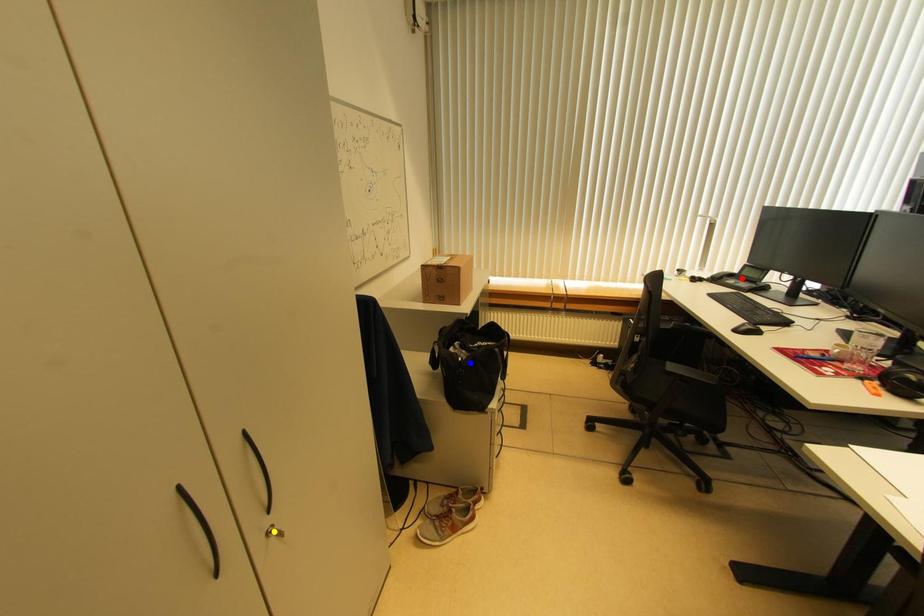
Order these from nearest to farthest:
blue point
red point
yellow point

1. yellow point
2. blue point
3. red point